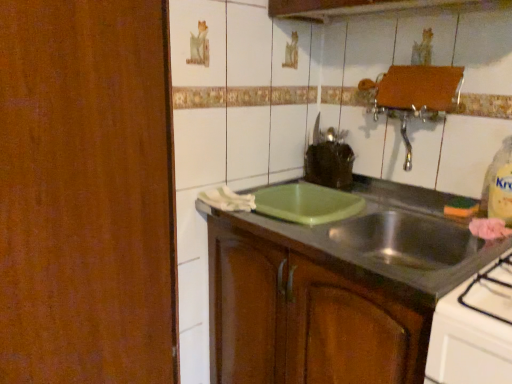
Question: From a real-world perspective, is green matte cutting board at center physically located above or below green plastic cutting board at center?

Choices:
 (A) above
 (B) below

Answer: (B)

Question: Relative to green plastic cutting board at center, is green matte cutting board at center in front or behind?

Choices:
 (A) behind
 (B) front

Answer: (A)

Question: Is green matte cutting board at center spatially inside green plastic cutting board at center, or outside of it?

Choices:
 (A) outside
 (B) inside

Answer: (A)

Question: From a real-world perspective, is green plastic cutting board at center physically located above or below green matte cutting board at center?

Choices:
 (A) above
 (B) below

Answer: (A)

Question: From their relative heights in the image, would you say green plastic cutting board at center is taller or shorter than green matte cutting board at center?

Choices:
 (A) tall
 (B) short

Answer: (B)

Question: Is green plastic cutting board at center bigger or smaller than green matte cutting board at center?

Choices:
 (A) small
 (B) big

Answer: (A)

Question: From the image's perspective, relative to green matte cutting board at center, is green plastic cutting board at center above or below?

Choices:
 (A) above
 (B) below

Answer: (A)